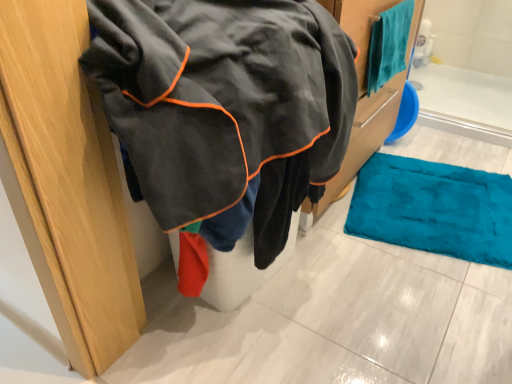
Question: In the image, is velvet-like black jacket at left positioned in front of or behind teal soft towel at upper right?

Choices:
 (A) front
 (B) behind

Answer: (A)

Question: Is velvet-like black jacket at left wider or thinner than teal soft towel at upper right?

Choices:
 (A) thin
 (B) wide

Answer: (B)

Question: In terms of size, does velvet-like black jacket at left appear bigger or smaller than teal soft towel at upper right?

Choices:
 (A) small
 (B) big

Answer: (B)

Question: Considering the positions of teal soft towel at upper right and velvet-like black jacket at left in the image, is teal soft towel at upper right wider or thinner than velvet-like black jacket at left?

Choices:
 (A) thin
 (B) wide

Answer: (A)

Question: Considering the relative positions of teal soft towel at upper right and velvet-like black jacket at left in the image provided, is teal soft towel at upper right to the left or to the right of velvet-like black jacket at left?

Choices:
 (A) right
 (B) left

Answer: (A)

Question: Considering the positions of teal soft towel at upper right and velvet-like black jacket at left in the image, is teal soft towel at upper right taller or shorter than velvet-like black jacket at left?

Choices:
 (A) short
 (B) tall

Answer: (A)

Question: From the image's perspective, is teal soft towel at upper right above or below velvet-like black jacket at left?

Choices:
 (A) below
 (B) above

Answer: (B)